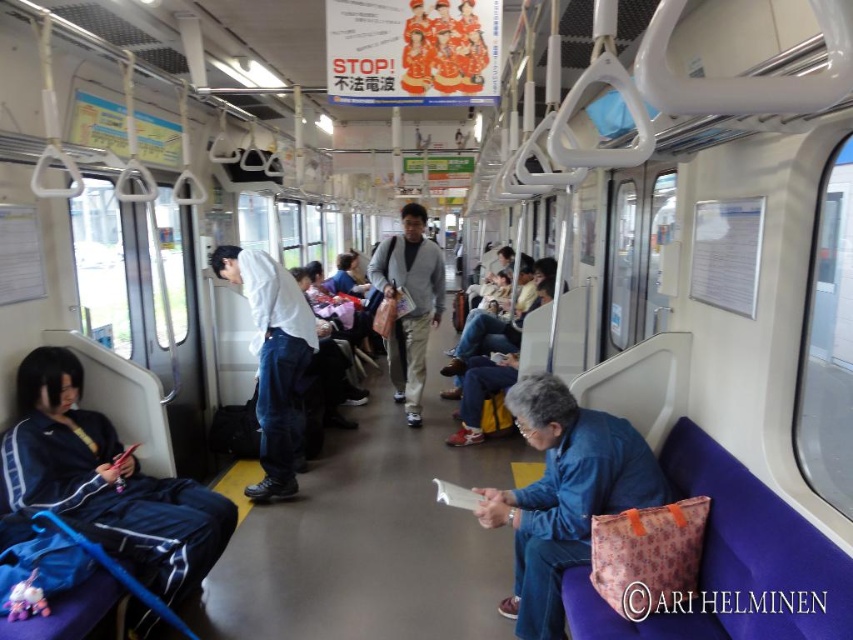
Can you confirm if denim pants at center is shorter than matte gray sweater at center?

Correct, denim pants at center is not as tall as matte gray sweater at center.

Is denim pants at center smaller than matte gray sweater at center?

Indeed, denim pants at center has a smaller size compared to matte gray sweater at center.

Is point (253, 340) closer to viewer compared to point (410, 307)?

Yes.

At what (x,y) coordinates should I click in order to perform the action: click on denim pants at center. Please return your answer as a coordinate pair (x, y). Image resolution: width=853 pixels, height=640 pixels. Looking at the image, I should click on (273, 362).

Between point (67, 365) and point (558, 387), which one is positioned behind?

Point (67, 365)

Is point (70, 456) farther from viewer compared to point (572, 532)?

That is True.

The height and width of the screenshot is (640, 853). I want to click on dark blue track suit at left, so pos(106,483).

Can you confirm if blue fabric bag at lower right is positioned to the left of denim pants at center?

No, blue fabric bag at lower right is not to the left of denim pants at center.

Measure the distance between blue fabric bag at lower right and denim pants at center.

blue fabric bag at lower right is 1.83 meters away from denim pants at center.

Which is behind, point (531, 630) or point (277, 403)?

The point (277, 403) is more distant.

Identify the location of blue fabric bag at lower right. The image size is (853, 640). (564, 496).